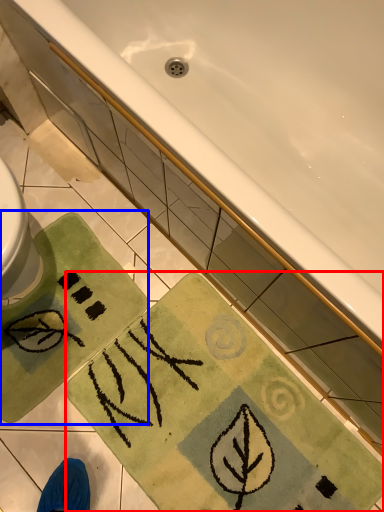
Question: Which of the following is the closest to the observer, beach towel (highlighted by a red box) or beach towel (highlighted by a blue box)?

Choices:
 (A) beach towel
 (B) beach towel

Answer: (A)